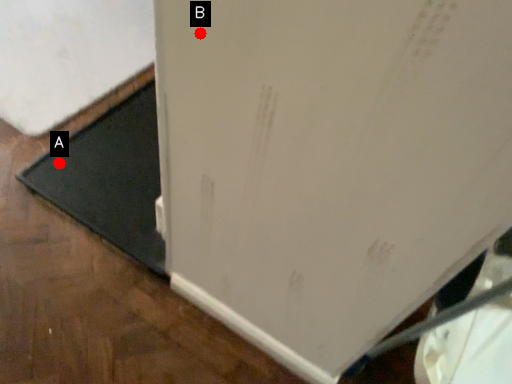
Question: Two points are circled on the image, labeled by A and B beside each circle. Which point is closer to the camera?

Choices:
 (A) A is closer
 (B) B is closer

Answer: (B)